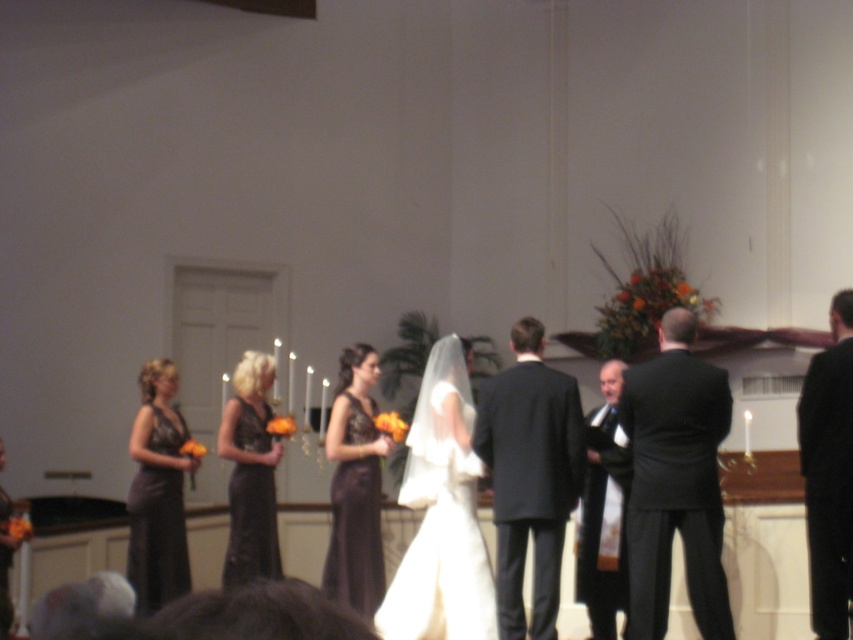
Question: Which point is closer to the camera?

Choices:
 (A) (157, 432)
 (B) (271, 472)
 (C) (816, 608)
 (D) (355, 557)

Answer: (C)

Question: Which point appears farthest from the camera in this image?

Choices:
 (A) (666, 552)
 (B) (579, 596)
 (C) (165, 461)
 (D) (840, 620)

Answer: (C)

Question: Can you confirm if matte black dress at center is wider than matte black dress at left?

Choices:
 (A) no
 (B) yes

Answer: (B)

Question: Which point appears farthest from the camera in this image?

Choices:
 (A) (741, 545)
 (B) (825, 605)
 (C) (698, 525)

Answer: (A)

Question: Is matte black dress at center in front of dark gray suit at center?

Choices:
 (A) no
 (B) yes

Answer: (B)

Question: Is black suit at right in front of matte black dress at left?

Choices:
 (A) yes
 (B) no

Answer: (A)